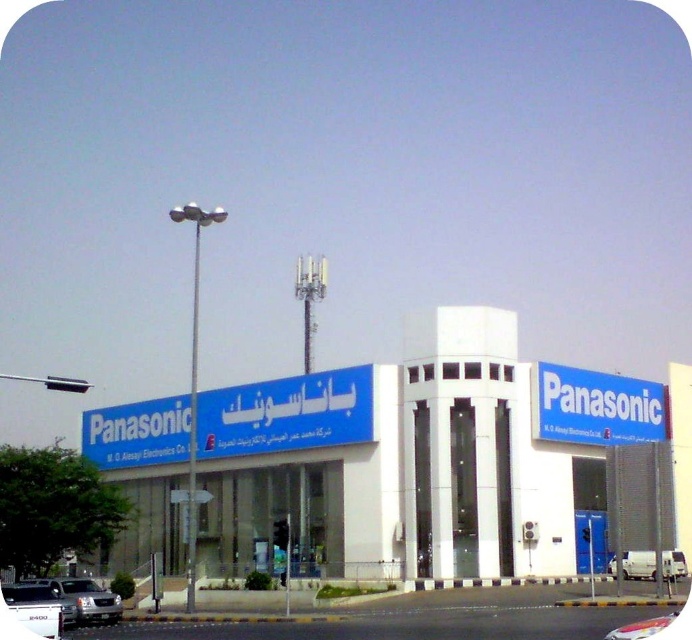
Is white matte van at lower left taller than white matte van at lower right?

Yes.

Image resolution: width=692 pixels, height=640 pixels. I want to click on white matte van at lower left, so click(x=35, y=609).

Can you confirm if white glossy building at center is wider than white matte van at lower left?

Yes, white glossy building at center is wider than white matte van at lower left.

Which is more to the left, white glossy building at center or white matte van at lower left?

white matte van at lower left is more to the left.

You are a GUI agent. You are given a task and a screenshot of the screen. Output one action in this format:
    pyautogui.click(x=<x>, y=<y>)
    Task: Click on the white glossy building at center
    The image size is (692, 640).
    Given the screenshot: What is the action you would take?
    pyautogui.click(x=418, y=460)

Can you confirm if white matte van at lower left is taller than silver metallic sedan at lower left?

Incorrect, white matte van at lower left's height is not larger of silver metallic sedan at lower left's.

Does white matte van at lower left have a smaller size compared to silver metallic sedan at lower left?

Correct, white matte van at lower left occupies less space than silver metallic sedan at lower left.

What do you see at coordinates (35, 609) in the screenshot? This screenshot has height=640, width=692. I see `white matte van at lower left` at bounding box center [35, 609].

Image resolution: width=692 pixels, height=640 pixels. Find the location of `white matte van at lower left`. white matte van at lower left is located at coordinates (35, 609).